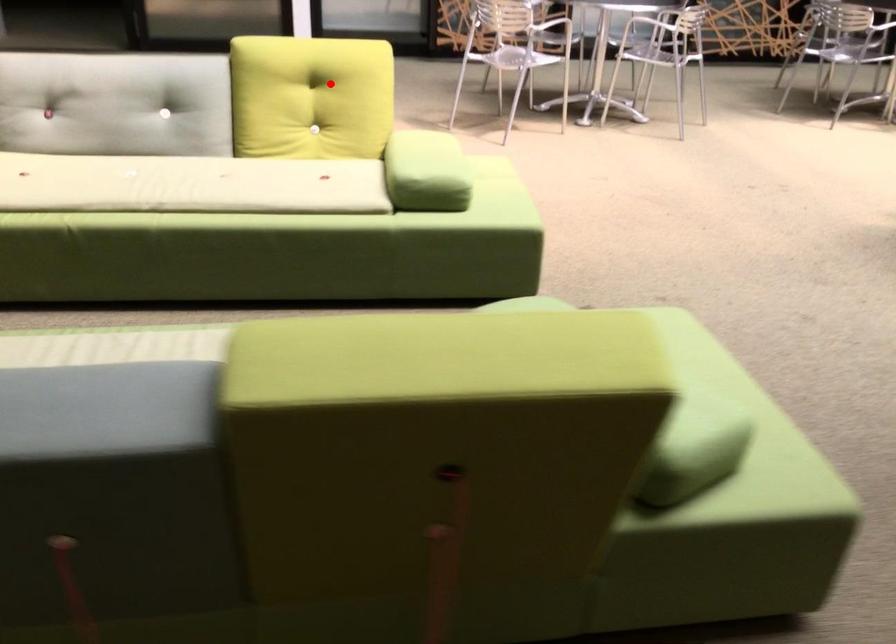
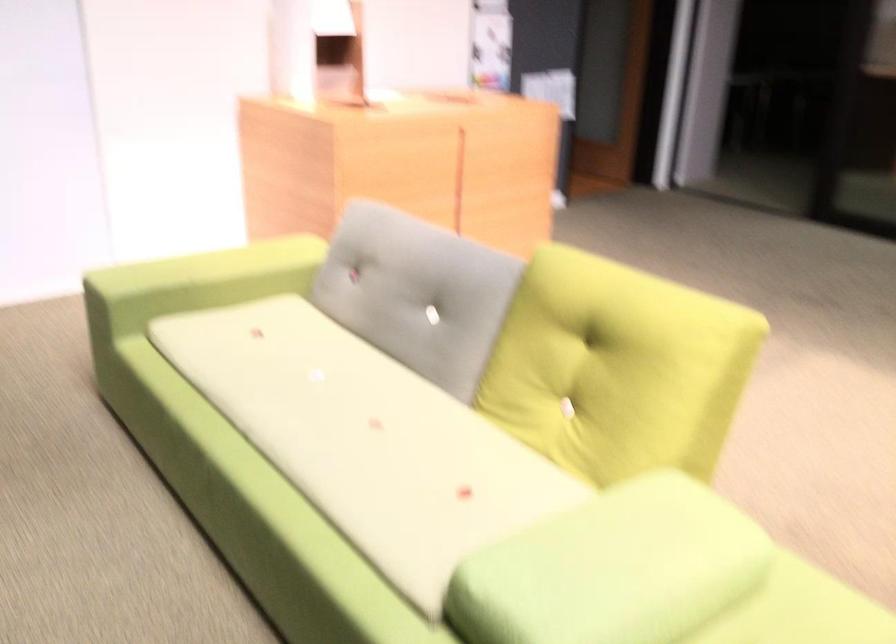
Find the pixel in the second image that matches the highlighted location in the first image.

(616, 368)